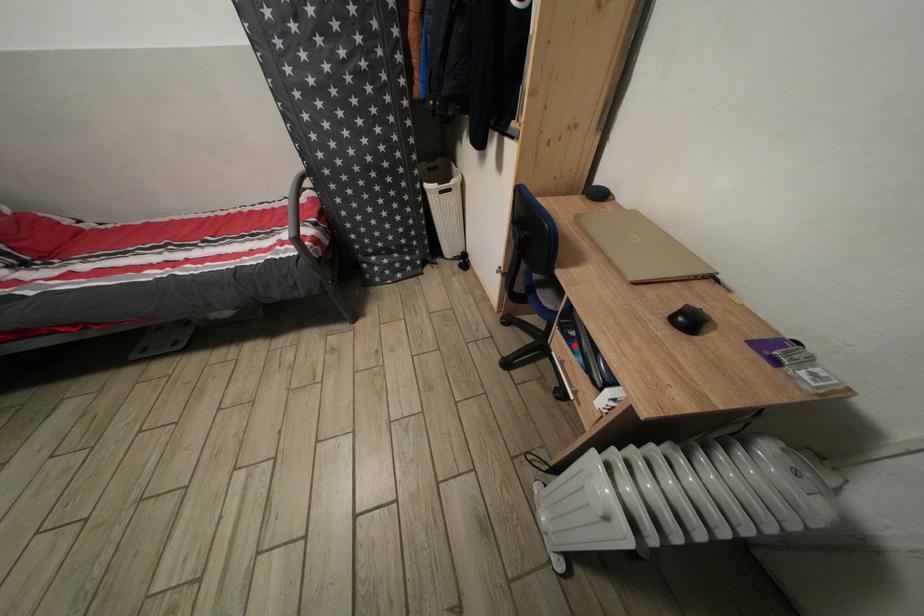
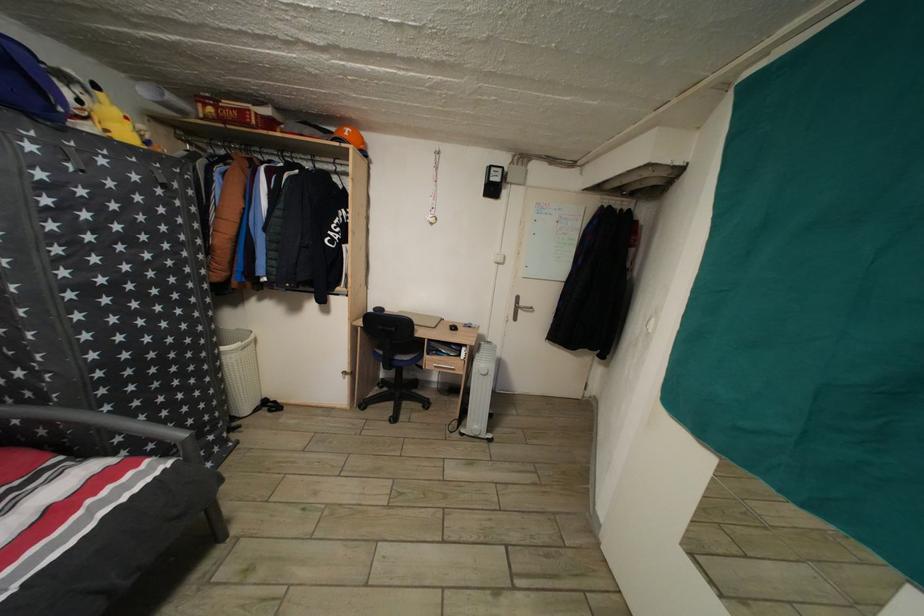
Question: I am providing you with two images of the same scene from different viewpoints. A red point is shown in image1. For the corresponding object point in image2, is it positioned nearer or farther from the camera?

Choices:
 (A) Nearer
 (B) Farther

Answer: (B)